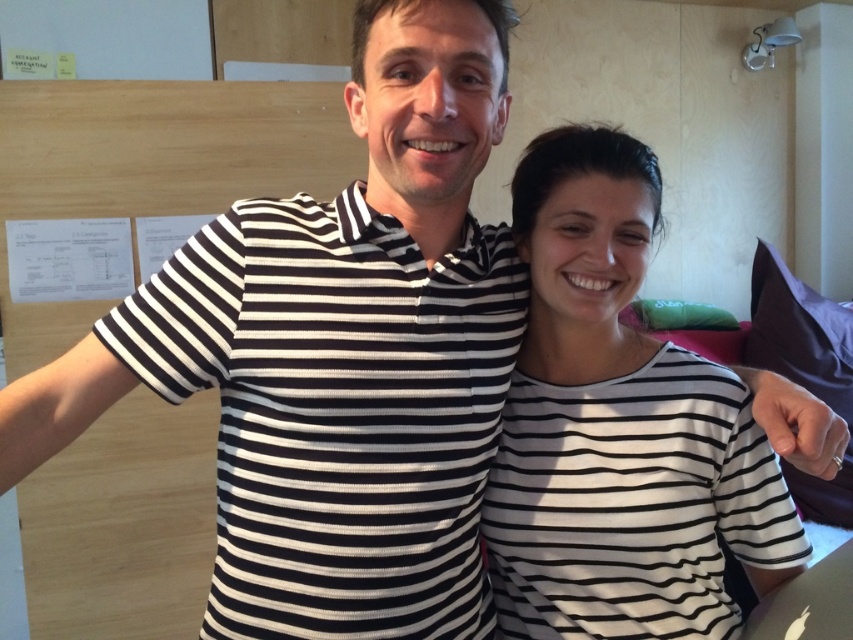
You are an office assistant who needs to determine which of the two people in the image is standing closer to the desk. Both are wearing horizontally striped shirts. The black striped polo shirt at center and the white striped shirt at center are visible. Can you figure out which one is closer to the desk?

The black striped polo shirt at center is positioned under the white striped shirt at center, which means the person wearing the black striped polo shirt at center is standing closer to the desk since they are lower in the image.

You are designing a photo frame that needs to accommodate both the black striped polo shirt at center and the white striped shirt at center in the image. Based on their widths, which shirt should you ensure the frame can accommodate first?

The black striped polo shirt at center might be wider than the white striped shirt at center, so the frame should first accommodate the black striped polo shirt at center to ensure it fits properly.

You are standing in front of the image and want to locate the black striped polo shirt at center. What are its coordinates?

The black striped polo shirt at center is located at coordinates point (337, 412).